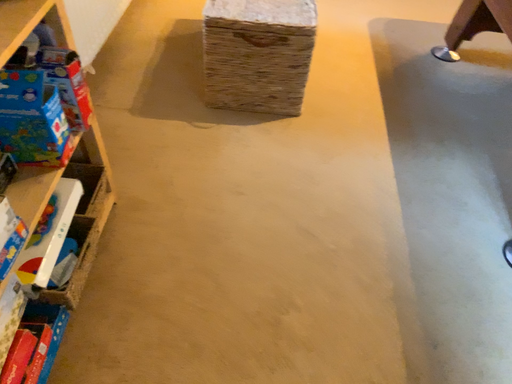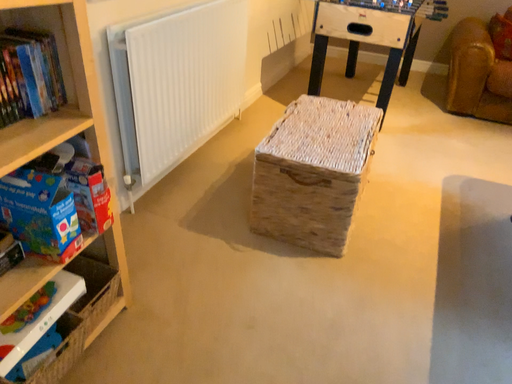
Question: How did the camera likely rotate when shooting the video?

Choices:
 (A) rotated right
 (B) rotated left

Answer: (B)